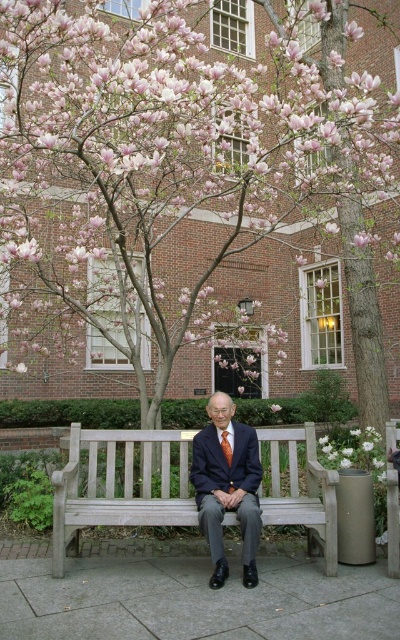
Which is in front, point (324, 84) or point (146, 520)?

Positioned in front is point (146, 520).

Is point (266, 81) less distant than point (177, 490)?

No, it is not.

The width and height of the screenshot is (400, 640). Identify the location of pink blossom tree at center. (181, 166).

Between point (164, 488) and point (222, 493), which one is positioned in front?

Point (222, 493)

Is wooden bench at center closer to camera compared to dark blue suit at center?

No, wooden bench at center is further to the viewer.

The image size is (400, 640). What do you see at coordinates (120, 484) in the screenshot? I see `wooden bench at center` at bounding box center [120, 484].

Find the location of a particular element. The width and height of the screenshot is (400, 640). wooden bench at center is located at coordinates (120, 484).

Which is more to the left, dark blue suit at center or orange silk tie at center?

Positioned to the left is dark blue suit at center.

Describe the element at coordinates (227, 486) in the screenshot. This screenshot has width=400, height=640. I see `dark blue suit at center` at that location.

Does point (208, 516) come in front of point (227, 432)?

Yes, point (208, 516) is in front of point (227, 432).

I want to click on dark blue suit at center, so click(x=227, y=486).